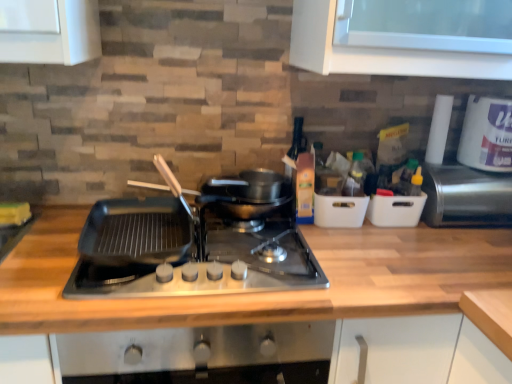
Describe the element at coordinates (184, 254) in the screenshot. This screenshot has height=384, width=512. I see `black matte griddle at center` at that location.

Where is `white plastic container at upper right`? The image size is (512, 384). white plastic container at upper right is located at coordinates (487, 134).

Describe the element at coordinates (487, 134) in the screenshot. I see `white plastic container at upper right` at that location.

The height and width of the screenshot is (384, 512). Describe the element at coordinates (396, 209) in the screenshot. I see `white plastic container at right, marked as the 2th appliance in a right-to-left arrangement` at that location.

Locate an element on the screen. The width and height of the screenshot is (512, 384). black matte wok at center is located at coordinates [148, 185].

Is white plastic container at upper right oriented away from black matte griddle at center?

No.

From the image's perspective, would you say white plastic container at upper right is shown under black matte griddle at center?

No, from the image's perspective, white plastic container at upper right is not beneath black matte griddle at center.

Would you say white plastic container at upper right is a long distance from black matte griddle at center?

They are positioned close to each other.

Between black matte griddle at center and metallic stainless steel toaster at right, the 1th appliance positioned from the right, which one appears on the right side from the viewer's perspective?

metallic stainless steel toaster at right, the 1th appliance positioned from the right.

From the image's perspective, is black matte griddle at center above or below metallic stainless steel toaster at right, which is counted as the 2th appliance, starting from the left?

Based on their image positions, black matte griddle at center is located beneath metallic stainless steel toaster at right, which is counted as the 2th appliance, starting from the left.

Can you confirm if black matte griddle at center is wider than metallic stainless steel toaster at right, which is counted as the 2th appliance, starting from the left?

Yes, black matte griddle at center is wider than metallic stainless steel toaster at right, which is counted as the 2th appliance, starting from the left.

In terms of height, does black matte griddle at center look taller or shorter compared to metallic stainless steel toaster at right, which is counted as the 2th appliance, starting from the left?

black matte griddle at center is shorter than metallic stainless steel toaster at right, which is counted as the 2th appliance, starting from the left.

Considering the positions of objects white plastic container at upper right and white plastic container at right, the 1th appliance when ordered from left to right, in the image provided, who is in front, white plastic container at upper right or white plastic container at right, the 1th appliance when ordered from left to right,?

Positioned in front is white plastic container at upper right.

Is white plastic container at upper right placed right next to white plastic container at right, marked as the 2th appliance in a right-to-left arrangement?

white plastic container at upper right and white plastic container at right, marked as the 2th appliance in a right-to-left arrangement, are not in contact.

The image size is (512, 384). Find the location of `the 2nd appliance positioned below the white plastic container at upper right (from a real-world perspective)`. the 2nd appliance positioned below the white plastic container at upper right (from a real-world perspective) is located at coordinates (396, 209).

From the image's perspective, is white plastic container at upper right on white plastic container at right, marked as the 2th appliance in a right-to-left arrangement?

Correct, white plastic container at upper right appears higher than white plastic container at right, marked as the 2th appliance in a right-to-left arrangement, in the image.

Does black matte wok at center turn towards white plastic container at upper right?

No, black matte wok at center is not aimed at white plastic container at upper right.

Considering the relative sizes of black matte wok at center and white plastic container at upper right in the image provided, is black matte wok at center smaller than white plastic container at upper right?

Yes.

Locate an element on the screen. wok below the white plastic container at upper right (from a real-world perspective) is located at coordinates pos(148,185).

In terms of height, does black matte wok at center look taller or shorter compared to white plastic container at upper right?

Considering their sizes, black matte wok at center has less height than white plastic container at upper right.

Considering the sizes of objects white plastic container at upper right and black matte wok at center in the image provided, who is taller, white plastic container at upper right or black matte wok at center?

white plastic container at upper right is taller.

Is black matte wok at center located within white plastic container at upper right?

No, black matte wok at center is not inside white plastic container at upper right.

Between white plastic container at upper right and black matte wok at center, which one has smaller size?

black matte wok at center.

How distant is white plastic container at upper right from black matte wok at center?

A distance of 28.15 inches exists between white plastic container at upper right and black matte wok at center.

Which is more to the right, wooden at center or metallic stainless steel toaster at right, the 1th appliance positioned from the right?

Positioned to the right is metallic stainless steel toaster at right, the 1th appliance positioned from the right.

Is wooden at center placed right next to metallic stainless steel toaster at right, which is counted as the 2th appliance, starting from the left?

wooden at center and metallic stainless steel toaster at right, which is counted as the 2th appliance, starting from the left, are clearly separated.

There is a wooden at center. Where is `the 2nd appliance above it (from a real-world perspective)`? The height and width of the screenshot is (384, 512). the 2nd appliance above it (from a real-world perspective) is located at coordinates (466, 197).

Which object is positioned more to the right, metallic stainless steel toaster at right, which is counted as the 2th appliance, starting from the left, or black matte griddle at center?

Positioned to the right is metallic stainless steel toaster at right, which is counted as the 2th appliance, starting from the left.

From a real-world perspective, is metallic stainless steel toaster at right, the 1th appliance positioned from the right, physically located above or below black matte griddle at center?

From a real-world perspective, metallic stainless steel toaster at right, the 1th appliance positioned from the right, is physically above black matte griddle at center.

Considering the sizes of objects metallic stainless steel toaster at right, the 1th appliance positioned from the right, and black matte griddle at center in the image provided, who is thinner, metallic stainless steel toaster at right, the 1th appliance positioned from the right, or black matte griddle at center?

metallic stainless steel toaster at right, the 1th appliance positioned from the right, is thinner.

Between metallic stainless steel toaster at right, the 1th appliance positioned from the right, and black matte griddle at center, which one has larger size?

black matte griddle at center.

Where is `gas stove located in front of the white plastic container at upper right`? The width and height of the screenshot is (512, 384). gas stove located in front of the white plastic container at upper right is located at coordinates (184, 254).

The width and height of the screenshot is (512, 384). In order to click on the 2nd appliance positioned above the black matte griddle at center (from a real-world perspective) in this screenshot , I will do `click(466, 197)`.

Which object lies further to the anchor point wooden at center, black matte wok at center or white plastic container at upper right?

Among the two, white plastic container at upper right is located further to wooden at center.

Looking at the image, which one is located further to black matte griddle at center, black matte wok at center or wooden at center?

Among the two, black matte wok at center is located further to black matte griddle at center.

Looking at the image, which one is located further to wooden at center, black matte wok at center or metallic stainless steel toaster at right, which is counted as the 2th appliance, starting from the left?

black matte wok at center is positioned further to the anchor wooden at center.

When comparing their distances from black matte griddle at center, does wooden at center or white plastic container at right, the 1th appliance when ordered from left to right, seem further?

white plastic container at right, the 1th appliance when ordered from left to right, lies further to black matte griddle at center than the other object.

In the scene shown: From the image, which object appears to be nearer to white plastic container at right, the 1th appliance when ordered from left to right, black matte griddle at center or white plastic container at upper right?

The object closer to white plastic container at right, the 1th appliance when ordered from left to right, is white plastic container at upper right.

Based on their spatial positions, is white plastic container at upper right or wooden at center closer to black matte wok at center?

Based on the image, wooden at center appears to be nearer to black matte wok at center.

From the image, which object appears to be farther from black matte wok at center, white plastic container at right, the 1th appliance when ordered from left to right, or black matte griddle at center?

white plastic container at right, the 1th appliance when ordered from left to right.

Considering their positions, is white plastic container at upper right positioned further to white plastic container at right, marked as the 2th appliance in a right-to-left arrangement, than black matte wok at center?

black matte wok at center is further to white plastic container at right, marked as the 2th appliance in a right-to-left arrangement.

This screenshot has height=384, width=512. In order to click on wok between black matte griddle at center and white plastic container at upper right in this screenshot , I will do `click(148, 185)`.

Where is `appliance located between white plastic container at right, marked as the 2th appliance in a right-to-left arrangement, and white plastic container at upper right in the left-right direction`? This screenshot has height=384, width=512. appliance located between white plastic container at right, marked as the 2th appliance in a right-to-left arrangement, and white plastic container at upper right in the left-right direction is located at coordinates (466, 197).

You are a GUI agent. You are given a task and a screenshot of the screen. Output one action in this format:
    pyautogui.click(x=<x>, y=<y>)
    Task: Click on the appliance between black matte griddle at center and metallic stainless steel toaster at right, the 1th appliance positioned from the right
    The image size is (512, 384).
    Given the screenshot: What is the action you would take?
    pyautogui.click(x=396, y=209)

Image resolution: width=512 pixels, height=384 pixels. Identify the location of wok between black matte griddle at center and metallic stainless steel toaster at right, which is counted as the 2th appliance, starting from the left, in the horizontal direction. (148, 185).